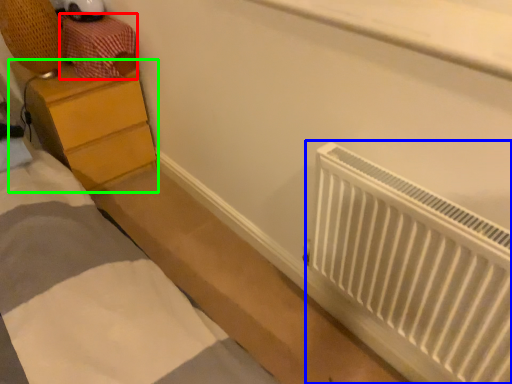
Question: Which object is positioned closest to drawer (highlighted by a red box)? Select from radiator (highlighted by a blue box) and chest of drawers (highlighted by a green box).

Choices:
 (A) radiator
 (B) chest of drawers

Answer: (B)